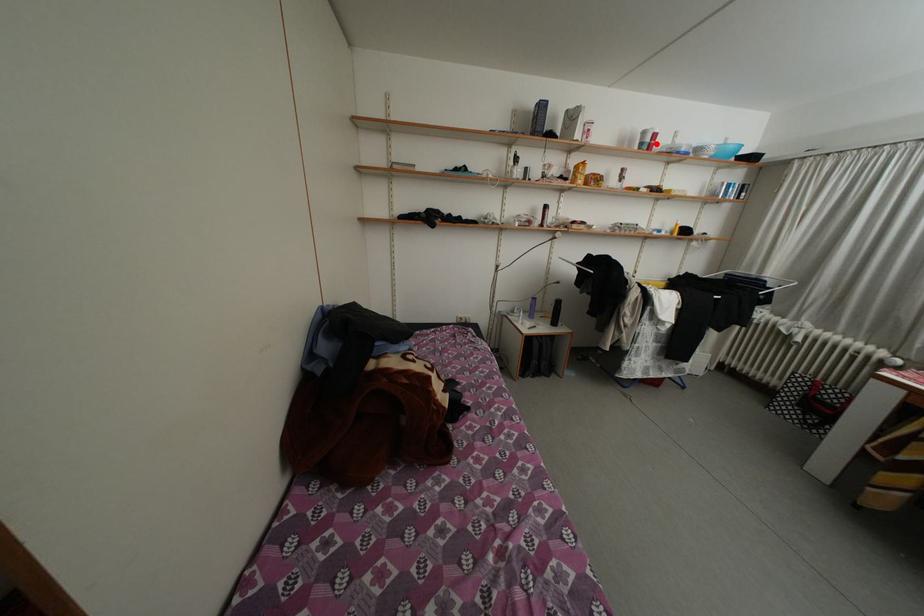
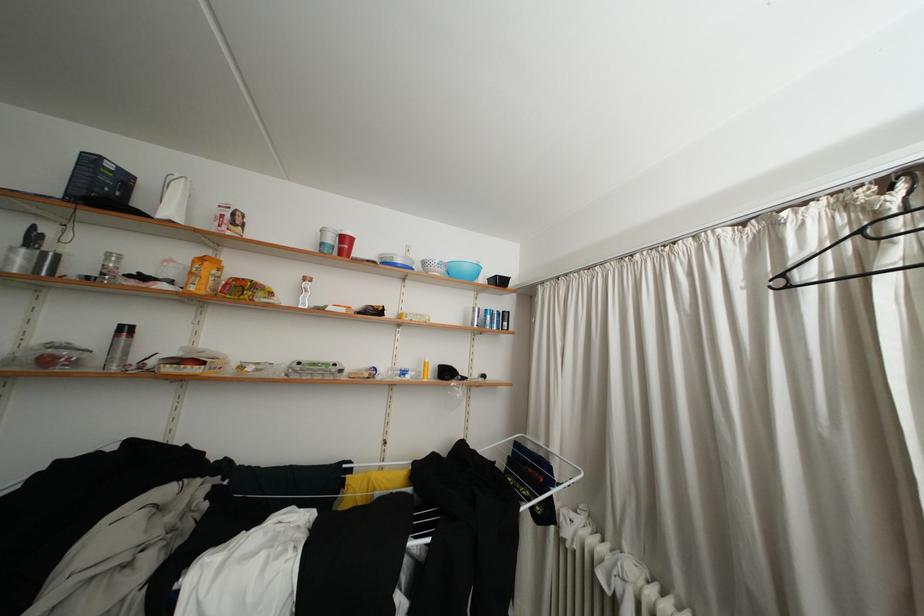
Locate, in the second image, the point that corresponds to the highlighted location in the first image.

(338, 245)